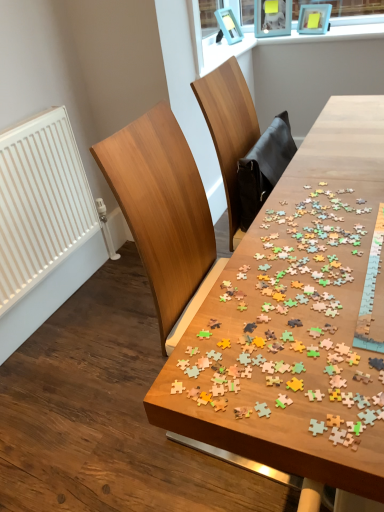
At what (x,y) coordinates should I click in order to perform the action: click on empty space that is to the right of white matte radiator at left. Please return your answer as a coordinate pair (x, y). This screenshot has height=512, width=384. Looking at the image, I should click on (114, 306).